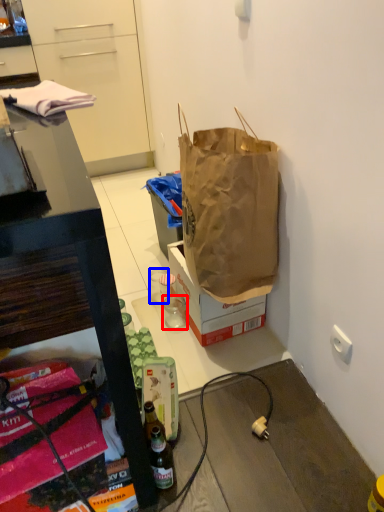
Question: Which point is closer to the camera, coffee cup (highlighted by a red box) or coffee cup (highlighted by a blue box)?

Choices:
 (A) coffee cup
 (B) coffee cup

Answer: (A)